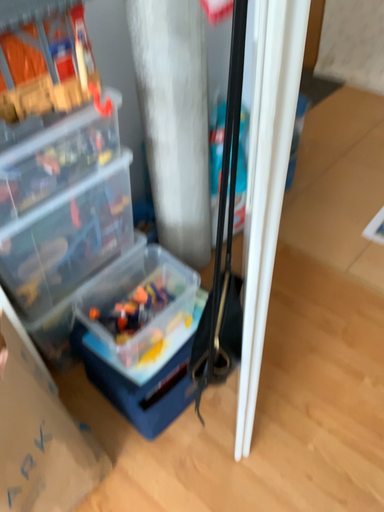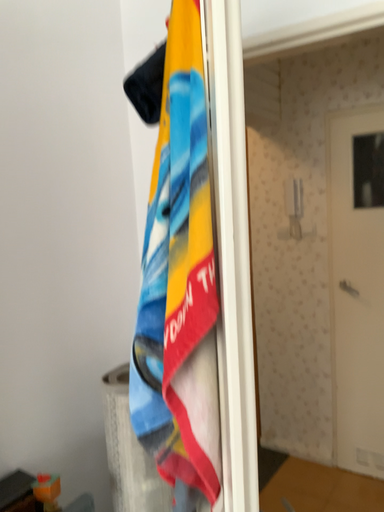
Question: How did the camera likely rotate when shooting the video?

Choices:
 (A) rotated upward
 (B) rotated downward

Answer: (A)